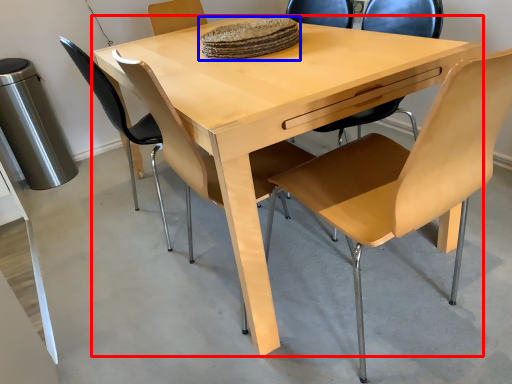
Question: Which object appears farthest to the camera in this image, table (highlighted by a red box) or food (highlighted by a blue box)?

Choices:
 (A) table
 (B) food

Answer: (B)